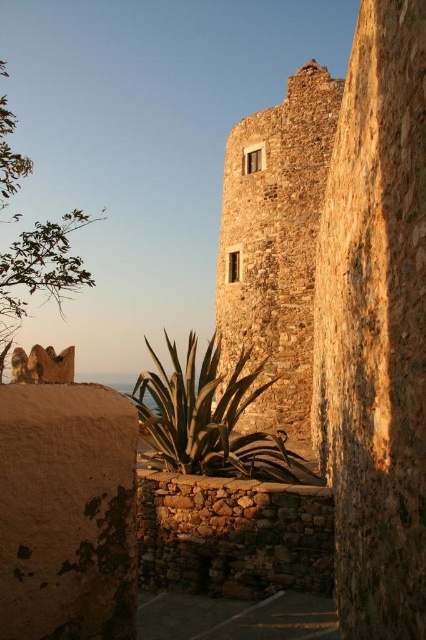
Question: Which of the following is the closest to the observer?

Choices:
 (A) (304, 136)
 (B) (169, 340)

Answer: (B)

Question: Does rustic stone tower at center come in front of green leafy plant at center?

Choices:
 (A) no
 (B) yes

Answer: (A)

Question: Does rustic stone tower at center appear on the left side of green leafy plant at center?

Choices:
 (A) yes
 (B) no

Answer: (B)

Question: Where is rustic stone tower at center located in relation to green leafy plant at center in the image?

Choices:
 (A) below
 (B) above

Answer: (B)

Question: Which of the following is the farthest from the observer?

Choices:
 (A) green leafy plant at center
 (B) rustic stone tower at center

Answer: (B)